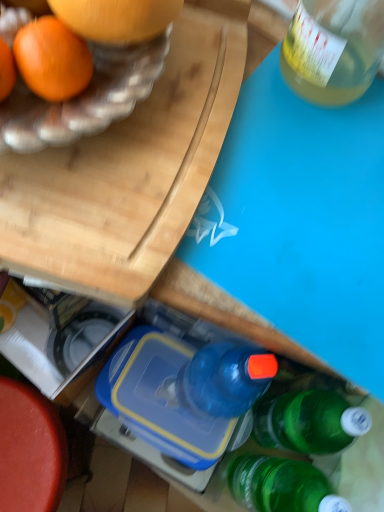
Image resolution: width=384 pixels, height=512 pixels. I want to click on blue plastic lunch box at center, so click(x=160, y=399).

Is smooth red table at lower left next to wooden cutting board at upper left?

smooth red table at lower left and wooden cutting board at upper left are clearly separated.

Could you tell me if smooth red table at lower left is facing wooden cutting board at upper left?

No, smooth red table at lower left is not turned towards wooden cutting board at upper left.

Which of these two, smooth red table at lower left or wooden cutting board at upper left, stands shorter?

With less height is wooden cutting board at upper left.

From a real-world perspective, which object stands above the other?

In real-world perspective, wooden cutting board at upper left is above.

From the picture: Can you tell me how much blue plastic lunch box at center and smooth red table at lower left differ in facing direction?

blue plastic lunch box at center and smooth red table at lower left are facing 28.2 degrees away from each other.

Looking at their sizes, would you say blue plastic lunch box at center is wider or thinner than smooth red table at lower left?

Considering their sizes, blue plastic lunch box at center looks slimmer than smooth red table at lower left.

Would you say blue plastic lunch box at center is inside or outside smooth red table at lower left?

blue plastic lunch box at center cannot be found inside smooth red table at lower left.

Consider the image. Between blue plastic lunch box at center and smooth red table at lower left, which one has less height?

blue plastic lunch box at center.

Is smooth red table at lower left completely or partially outside of blue plastic lunch box at center?

smooth red table at lower left lies outside blue plastic lunch box at center's area.

From the image's perspective, between smooth red table at lower left and blue plastic lunch box at center, which one is located above?

blue plastic lunch box at center, from the image's perspective.

From the picture: Is smooth red table at lower left with blue plastic lunch box at center?

smooth red table at lower left and blue plastic lunch box at center are clearly separated.

Considering the positions of objects smooth red table at lower left and blue plastic lunch box at center in the image provided, who is more to the left, smooth red table at lower left or blue plastic lunch box at center?

smooth red table at lower left is more to the left.

What's the angular difference between blue plastic lunch box at center and wooden cutting board at upper left's facing directions?

67.2 degrees separate the facing orientations of blue plastic lunch box at center and wooden cutting board at upper left.

Can you confirm if blue plastic lunch box at center is taller than wooden cutting board at upper left?

Yes, blue plastic lunch box at center is taller than wooden cutting board at upper left.

From the image's perspective, between blue plastic lunch box at center and wooden cutting board at upper left, who is located below?

blue plastic lunch box at center.

Is blue plastic lunch box at center not within wooden cutting board at upper left?

Yes, blue plastic lunch box at center is not within wooden cutting board at upper left.

Considering the relative positions of wooden cutting board at upper left and blue plastic lunch box at center in the image provided, is wooden cutting board at upper left in front of blue plastic lunch box at center?

That is True.

Looking at this image, can you tell me how much wooden cutting board at upper left and blue plastic lunch box at center differ in facing direction?

The angular difference between wooden cutting board at upper left and blue plastic lunch box at center is 67.2 degrees.

From the image's perspective, would you say wooden cutting board at upper left is shown under blue plastic lunch box at center?

Incorrect, from the image's perspective, wooden cutting board at upper left is higher than blue plastic lunch box at center.

Which object is positioned more to the left, wooden cutting board at upper left or blue plastic lunch box at center?

wooden cutting board at upper left is more to the left.

Do you think wooden cutting board at upper left is within smooth red table at lower left, or outside of it?

wooden cutting board at upper left cannot be found inside smooth red table at lower left.

Does point (178, 97) come in front of point (19, 467)?

Yes, point (178, 97) is in front of point (19, 467).

From their relative heights in the image, would you say wooden cutting board at upper left is taller or shorter than smooth red table at lower left?

In the image, wooden cutting board at upper left appears to be shorter than smooth red table at lower left.

Considering the sizes of wooden cutting board at upper left and smooth red table at lower left in the image, is wooden cutting board at upper left wider or thinner than smooth red table at lower left?

wooden cutting board at upper left is thinner than smooth red table at lower left.

Where is `cutting board located above the smooth red table at lower left (from a real-world perspective)`? Image resolution: width=384 pixels, height=512 pixels. cutting board located above the smooth red table at lower left (from a real-world perspective) is located at coordinates (129, 170).

Identify the location of lunch box lying in front of the smooth red table at lower left. (160, 399).

In the scene shown: Which object lies further to the anchor point blue plastic lunch box at center, smooth red table at lower left or wooden cutting board at upper left?

wooden cutting board at upper left.

Considering their positions, is wooden cutting board at upper left positioned closer to blue plastic lunch box at center than smooth red table at lower left?

smooth red table at lower left lies closer to blue plastic lunch box at center than the other object.

Which object lies nearer to the anchor point smooth red table at lower left, blue plastic lunch box at center or wooden cutting board at upper left?

Based on the image, blue plastic lunch box at center appears to be nearer to smooth red table at lower left.

Looking at this image, when comparing their distances from smooth red table at lower left, does wooden cutting board at upper left or blue plastic lunch box at center seem closer?

blue plastic lunch box at center is positioned closer to the anchor smooth red table at lower left.

Considering their positions, is smooth red table at lower left positioned closer to wooden cutting board at upper left than blue plastic lunch box at center?

Based on the image, blue plastic lunch box at center appears to be nearer to wooden cutting board at upper left.

Based on the photo, from the image, which object appears to be farther from wooden cutting board at upper left, blue plastic lunch box at center or smooth red table at lower left?

Among the two, smooth red table at lower left is located further to wooden cutting board at upper left.

Identify the location of lunch box between wooden cutting board at upper left and smooth red table at lower left vertically. (160, 399).